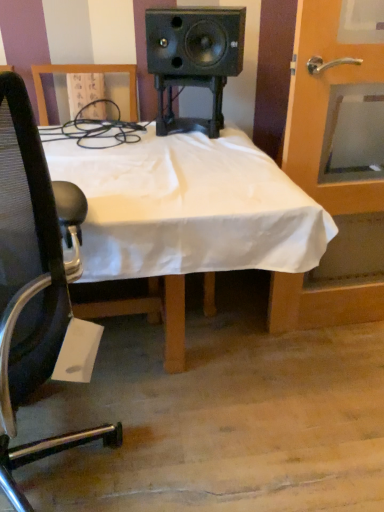
Question: Is black mesh chair at left spatially inside wooden door at right, or outside of it?

Choices:
 (A) outside
 (B) inside

Answer: (A)

Question: Considering the positions of black mesh chair at left and wooden door at right in the image, is black mesh chair at left taller or shorter than wooden door at right?

Choices:
 (A) tall
 (B) short

Answer: (B)

Question: Which object is the farthest from the black mesh chair at left?

Choices:
 (A) white cloth-covered desk at center
 (B) wooden door at right

Answer: (B)

Question: Which of these objects is positioned closest to the wooden door at right?

Choices:
 (A) black mesh chair at left
 (B) white cloth-covered desk at center

Answer: (B)